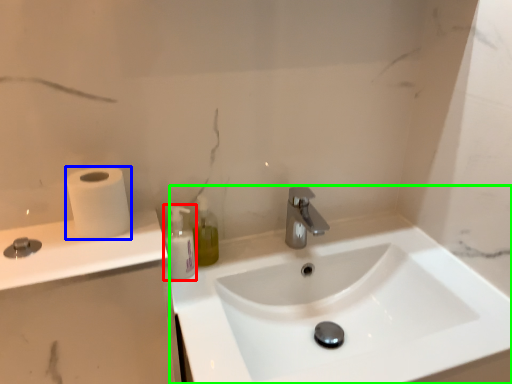
Question: Based on their relative distances, which object is farther from mouthwash (highlighted by a red box)? Choose from toilet paper (highlighted by a blue box) and sink (highlighted by a green box).

Choices:
 (A) toilet paper
 (B) sink

Answer: (B)